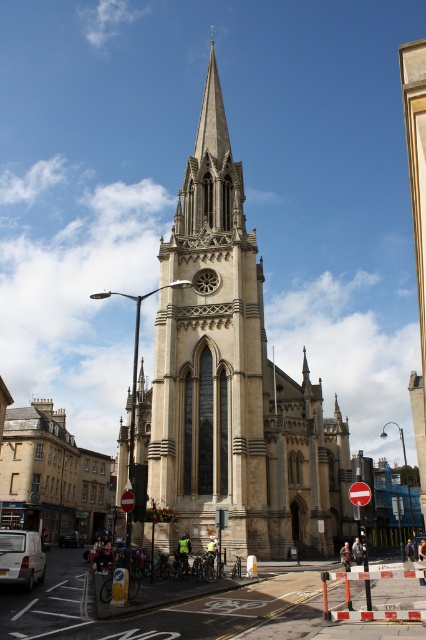
You are standing in front of the Gothic church and looking at two points marked on the ground. The first point is at coordinates point (0, 570) and the second is at point (60, 536). Which point is closer to you?

Point (0, 570) is closer to the viewer than point (60, 536).

You are standing at the base of the grand Gothic church and want to walk to the point marked at coordinates point (57, 522). How far will you have to walk to reach that point?

The distance between point (57, 522) and the viewer is 96.25 meters, so you will have to walk 96.25 meters to reach that point.